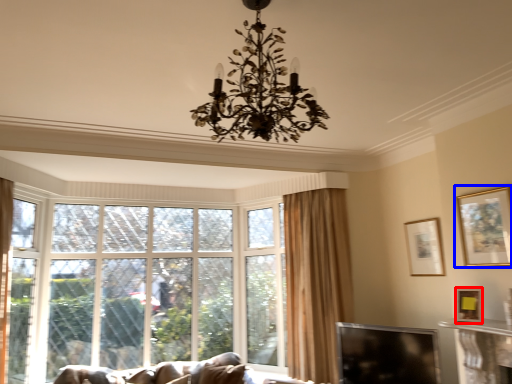
Question: Which point is further to the camera, picture frame (highlighted by a red box) or picture frame (highlighted by a blue box)?

Choices:
 (A) picture frame
 (B) picture frame

Answer: (A)